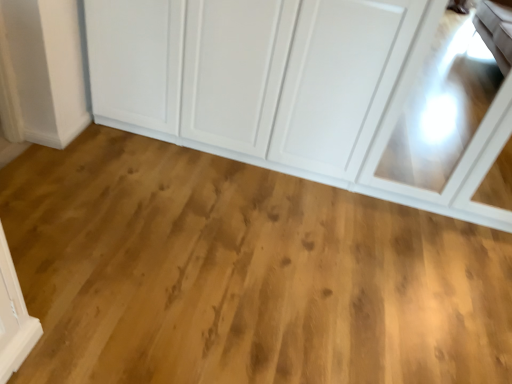
Question: Considering the positions of point (233, 271) and point (445, 192), is point (233, 271) closer or farther from the camera than point (445, 192)?

Choices:
 (A) farther
 (B) closer

Answer: (B)

Question: Which is correct: natural wood floor at center is inside white glossy cupboard at upper center, or outside of it?

Choices:
 (A) outside
 (B) inside

Answer: (A)

Question: In terms of height, does natural wood floor at center look taller or shorter compared to white glossy cupboard at upper center?

Choices:
 (A) tall
 (B) short

Answer: (B)

Question: Considering the positions of white glossy cupboard at upper center and natural wood floor at center in the image, is white glossy cupboard at upper center taller or shorter than natural wood floor at center?

Choices:
 (A) short
 (B) tall

Answer: (B)

Question: From the image's perspective, is white glossy cupboard at upper center positioned above or below natural wood floor at center?

Choices:
 (A) below
 (B) above

Answer: (B)

Question: From a real-world perspective, relative to natural wood floor at center, is white glossy cupboard at upper center vertically above or below?

Choices:
 (A) below
 (B) above

Answer: (B)

Question: Is white glossy cupboard at upper center inside or outside of natural wood floor at center?

Choices:
 (A) inside
 (B) outside

Answer: (B)